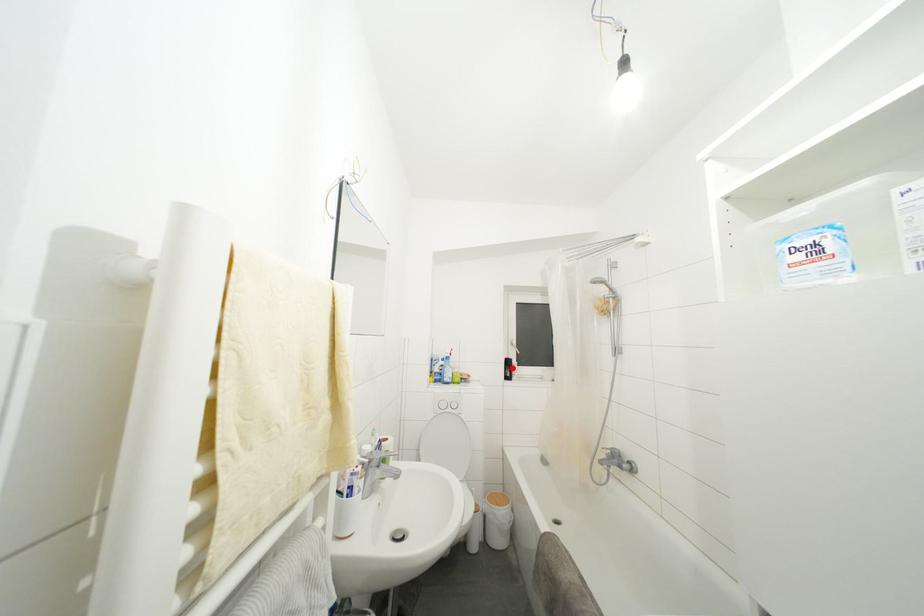
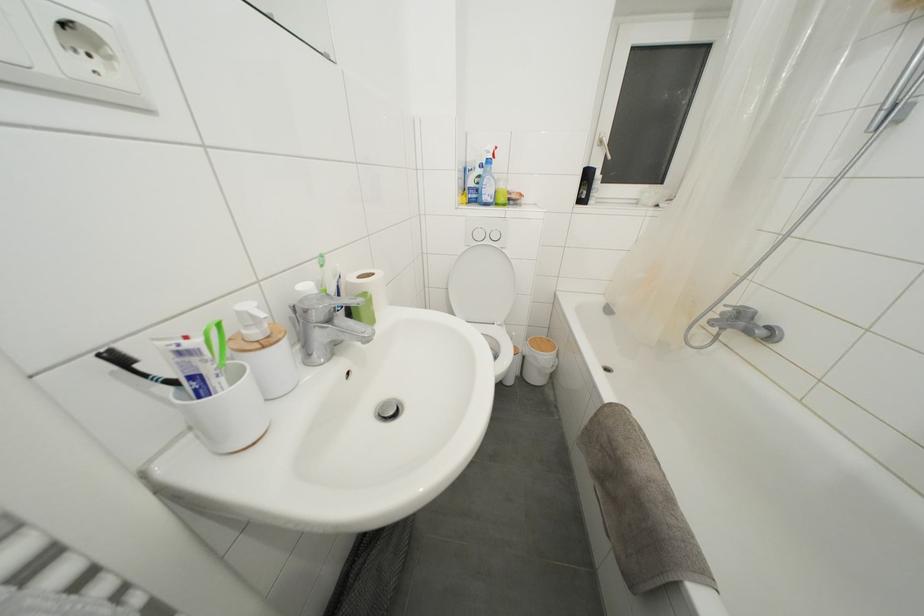
Question: I am providing you with two images of the same scene from different viewpoints. Given a red point in image1, look at the same physical point in image2. Is it:

Choices:
 (A) Closer to the viewpoint
 (B) Farther from the viewpoint

Answer: (A)